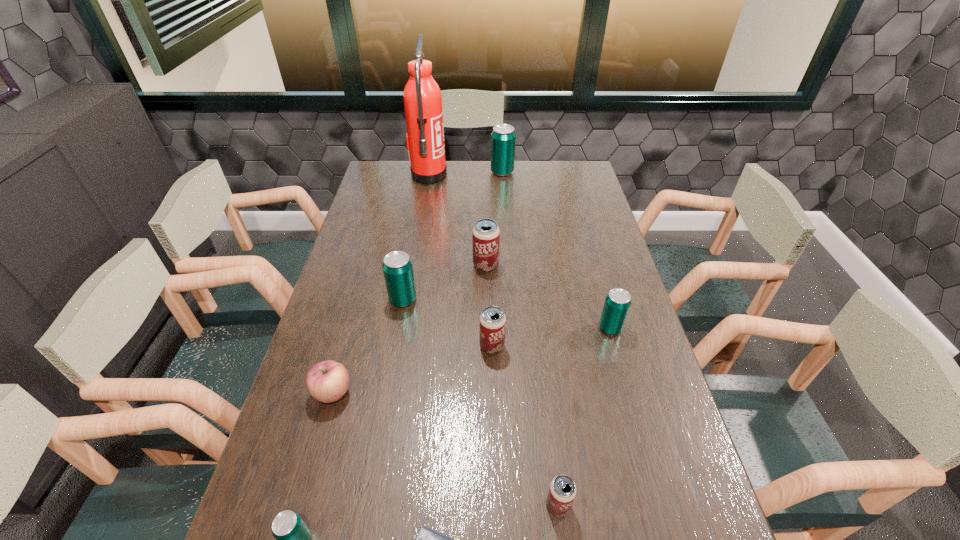
Identify which teal beer can is located as the nearest to the nearest beer can. Please provide its 2D coordinates. Your answer should be formatted as a tuple, i.e. [(x, y)], where the tuple contains the x and y coordinates of a point satisfying the conditions above.

[(397, 267)]

Identify which red beer can is the closest to the farthest red beer can. Please provide its 2D coordinates. Your answer should be formatted as a tuple, i.e. [(x, y)], where the tuple contains the x and y coordinates of a point satisfying the conditions above.

[(492, 320)]

I want to click on the closest red beer can relative to the shortest object, so click(562, 491).

Find the location of `vacant space that satisfies the following two spatial constraints: 1. on the back side of the apple; 2. on the right side of the farthest red beer can`. vacant space that satisfies the following two spatial constraints: 1. on the back side of the apple; 2. on the right side of the farthest red beer can is located at coordinates (369, 265).

This screenshot has width=960, height=540. Identify the location of vacant space that satisfies the following two spatial constraints: 1. on the front side of the rightmost teal beer can; 2. on the left side of the second tallest object. (514, 328).